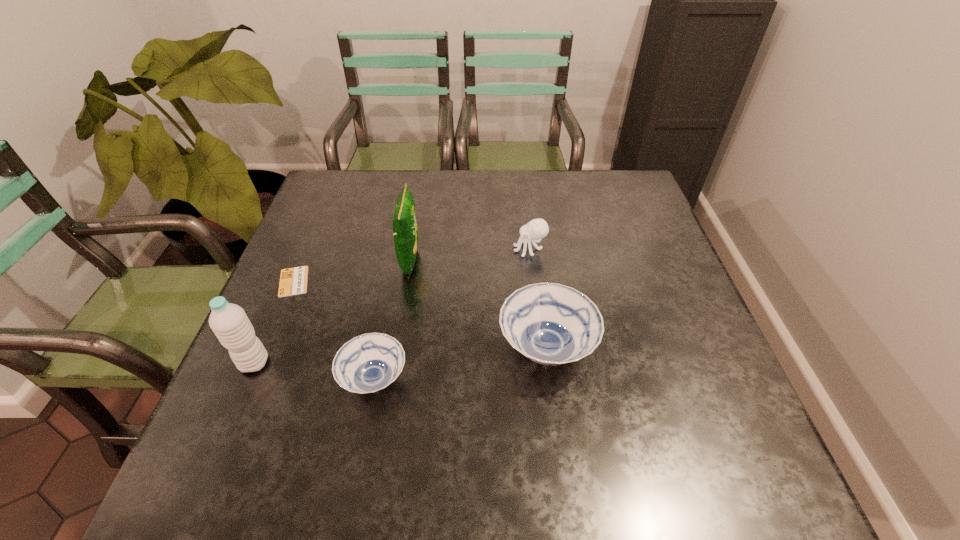
This screenshot has width=960, height=540. In order to click on vacant region located on the front of the shortest object in this screenshot , I will do `click(280, 313)`.

You are a GUI agent. You are given a task and a screenshot of the screen. Output one action in this format:
    pyautogui.click(x=<x>, y=<y>)
    Task: Click on the vacant space located 0.180m on the right of the water bottle
    The image size is (960, 540).
    Given the screenshot: What is the action you would take?
    pyautogui.click(x=355, y=363)

This screenshot has height=540, width=960. In order to click on vacant region located 0.400m on the front-facing side of the octopus in this screenshot , I will do (364, 249).

Identify the location of free spot located 0.320m on the front-facing side of the octopus. (394, 249).

Image resolution: width=960 pixels, height=540 pixels. I want to click on vacant space situated 0.400m on the front-facing side of the octopus, so click(364, 249).

You are a GUI agent. You are given a task and a screenshot of the screen. Output one action in this format:
    pyautogui.click(x=<x>, y=<y>)
    Task: Click on the object located in the near edge section of the desktop
    
    Given the screenshot: What is the action you would take?
    pyautogui.click(x=368, y=363)

Locate an element on the screen. The width and height of the screenshot is (960, 540). identity card present at the left edge is located at coordinates (293, 281).

Find the location of a particular element. This screenshot has height=540, width=960. water bottle at the left edge is located at coordinates (229, 322).

You are a GUI agent. You are given a task and a screenshot of the screen. Output one action in this format:
    pyautogui.click(x=<x>, y=<y>)
    Task: Click on the vacant space at the far edge of the desktop
    This screenshot has height=540, width=960.
    Given the screenshot: What is the action you would take?
    pyautogui.click(x=422, y=193)

In the image, there is a desktop. Where is `vacant space at the near edge`? vacant space at the near edge is located at coordinates (357, 404).